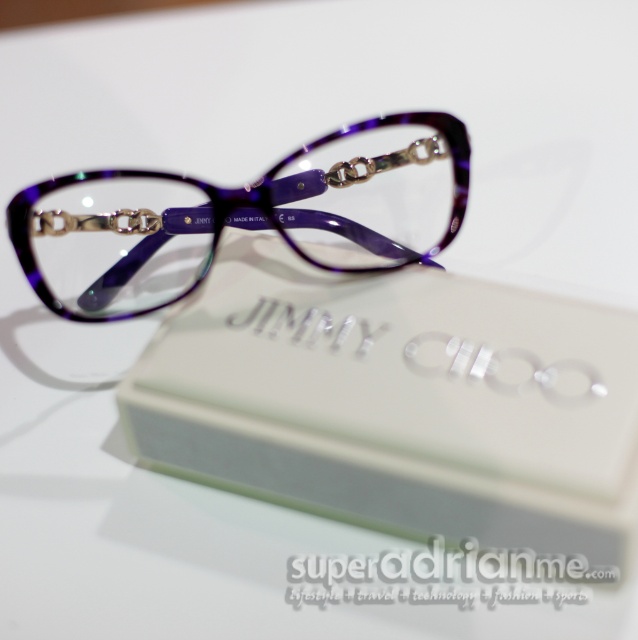
Is point (417, 352) behind point (387, 248)?

No, it is in front of (387, 248).

Image resolution: width=638 pixels, height=640 pixels. What do you see at coordinates (401, 406) in the screenshot?
I see `matte purple plastic box at center` at bounding box center [401, 406].

Locate an element on the screen. matte purple plastic box at center is located at coordinates (401, 406).